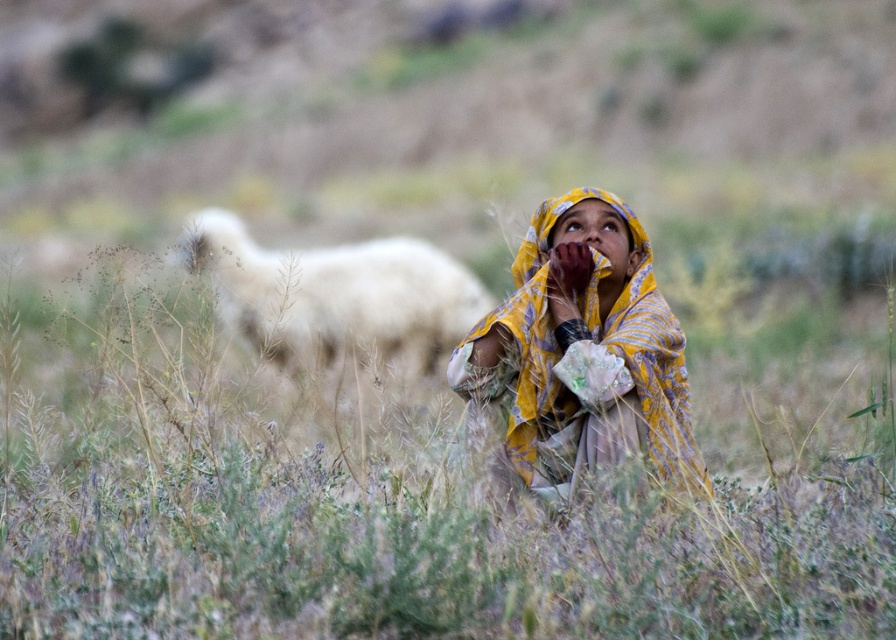
Based on the photo, you are a photographer trying to capture the girl in the scene. You want to make sure the green grass at center and the yellow printed scarf at center are both visible in the frame. Based on their positions, which object should you focus on first to ensure both are in the shot?

The green grass at center is positioned on the left side of yellow printed scarf at center. To ensure both are in the shot, focus on the yellow printed scarf at center first since it is on the right, allowing the green grass at center to naturally fall into the frame on the left.

You are standing in the field and want to reach the point marked as point (625, 289). If your walking speed is 1.2 meters per second, how many seconds will it take you to reach that point?

The distance of point (625, 289) from viewer is 5.52 meters. At a speed of 1.2 meters per second, it would take approximately 4.6 seconds to reach the point.

You are standing at the center of the field and see the point marked as point (415, 492). What is the surface type of the ground at that point?

Answer: The point (415, 492) is on green grass at center, so the surface type is green grass.